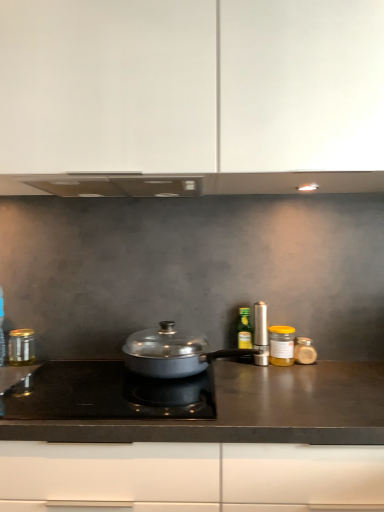
The image size is (384, 512). I want to click on free space on the front side of yellow glass jar at right, marked as the second kitchen appliance in a right-to-left arrangement, so click(x=288, y=374).